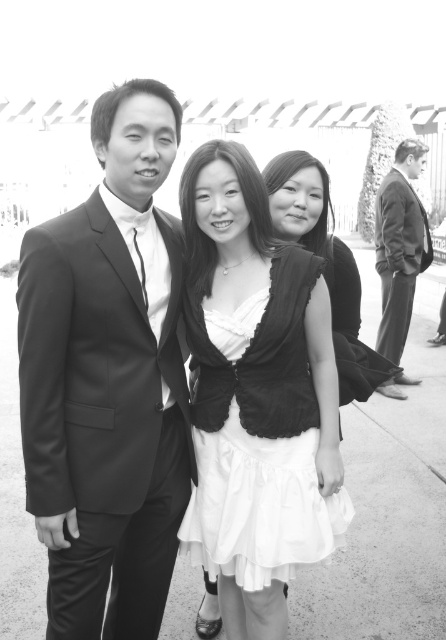
Question: Can you confirm if smooth black suit at left is bigger than white satin dress at center?

Choices:
 (A) no
 (B) yes

Answer: (B)

Question: Is smooth black suit at left behind matte black dress at center?

Choices:
 (A) no
 (B) yes

Answer: (A)

Question: Is smooth black suit at left thinner than dark suit at right?

Choices:
 (A) no
 (B) yes

Answer: (A)

Question: Which of the following is the closest to the observer?

Choices:
 (A) (267, 381)
 (B) (382, 308)
 (C) (265, 172)
 (D) (123, 394)

Answer: (D)

Question: Which point is farther from the camera taking this photo?

Choices:
 (A) (232, 371)
 (B) (341, 314)
 (C) (428, 264)
 (D) (41, 461)

Answer: (C)

Question: Considering the real-world distances, which object is farthest from the matte black dress at center?

Choices:
 (A) smooth black suit at left
 (B) white satin dress at center
 (C) dark suit at right

Answer: (C)